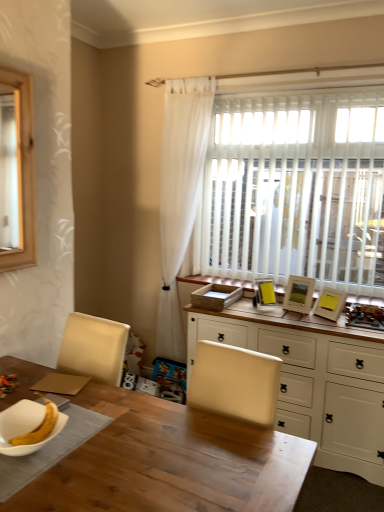
Question: Relative to wooden photo frame at right, the second picture frame viewed from the right, is wooden picture frame at upper right, which ranks as the first picture frame in right-to-left order, in front or behind?

Choices:
 (A) front
 (B) behind

Answer: (A)

Question: Is wooden picture frame at upper right, which ranks as the first picture frame in right-to-left order, inside or outside of wooden photo frame at right, the second picture frame in the left-to-right sequence?

Choices:
 (A) inside
 (B) outside

Answer: (B)

Question: Considering the real-world distances, which object is farthest from the wooden table at center?

Choices:
 (A) wooden photo frame at right, the second picture frame viewed from the right
 (B) wooden picture frame at upper right, which ranks as the first picture frame in right-to-left order
 (C) white sheer curtain at upper right
 (D) white wood cabinet at center
 (E) matte yellow picture frame at upper right, positioned as the third picture frame in right-to-left order

Answer: (C)

Question: Estimate the real-world distances between objects in this image. Which object is farther from the white sheer curtain at upper right?

Choices:
 (A) wooden picture frame at upper right, which ranks as the first picture frame in right-to-left order
 (B) white glossy bowl at lower left
 (C) matte yellow picture frame at upper right, the first picture frame from the left
 (D) wooden table at center
 (E) wooden photo frame at right, the second picture frame viewed from the right

Answer: (B)